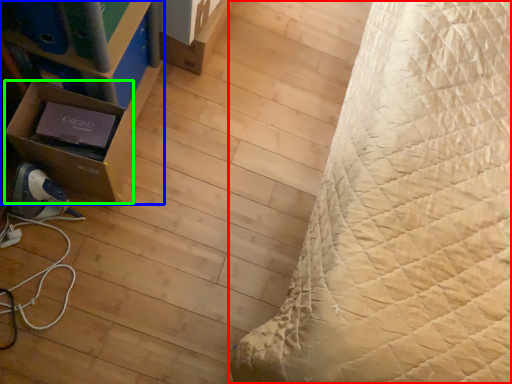
Question: Estimate the real-world distances between objects in this image. Which object is farther from bed (highlighted by a red box), furniture (highlighted by a blue box) or cardboard box (highlighted by a green box)?

Choices:
 (A) furniture
 (B) cardboard box

Answer: (B)